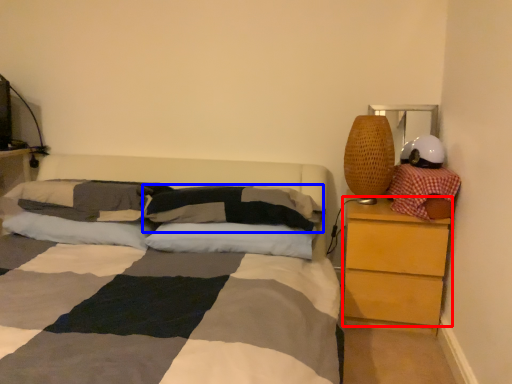
Question: Which object is further to the camera taking this photo, chest of drawers (highlighted by a red box) or pillow (highlighted by a blue box)?

Choices:
 (A) chest of drawers
 (B) pillow

Answer: (A)